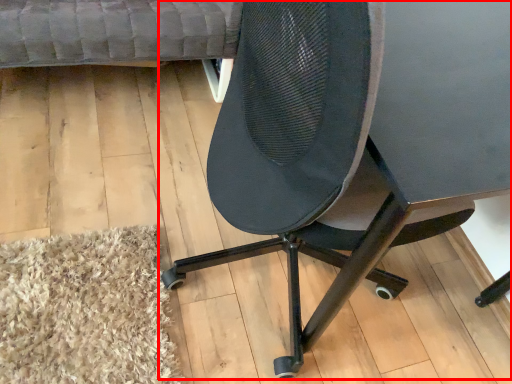
Question: From the image's perspective, what is the correct spatial relationship of chair (annotated by the red box) in relation to couch?

Choices:
 (A) above
 (B) below

Answer: (B)